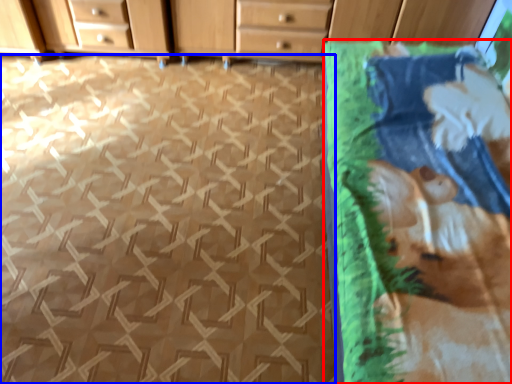
Question: Which point is further to the camera, blanket (highlighted by a red box) or tile (highlighted by a blue box)?

Choices:
 (A) blanket
 (B) tile

Answer: (B)